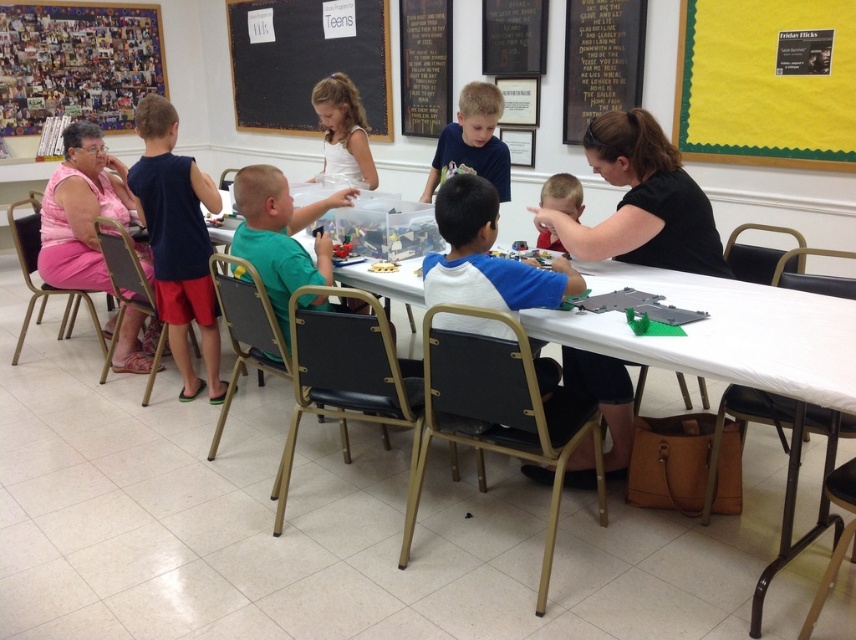
Does pink fabric dress at left have a greater height compared to blue matte shirt at center?

Correct, pink fabric dress at left is much taller as blue matte shirt at center.

Who is more distant from viewer, (76, 177) or (509, 164)?

Positioned behind is point (76, 177).

The width and height of the screenshot is (856, 640). What do you see at coordinates (80, 211) in the screenshot?
I see `pink fabric dress at left` at bounding box center [80, 211].

What are the coordinates of `pink fabric dress at left` in the screenshot? It's located at (80, 211).

Which of these two, white satin dress at center or smooth plastic toy at center, stands shorter?

Standing shorter between the two is smooth plastic toy at center.

Between point (366, 145) and point (541, 246), which one is positioned in front?

Point (541, 246) is more forward.

Is point (348, 147) less distant than point (578, 220)?

No, it is not.

Identify the location of white satin dress at center. (343, 129).

Who is more forward, (x=277, y=29) or (x=363, y=134)?

Positioned in front is point (x=363, y=134).

I want to click on white chalkboard at upper center, so click(306, 60).